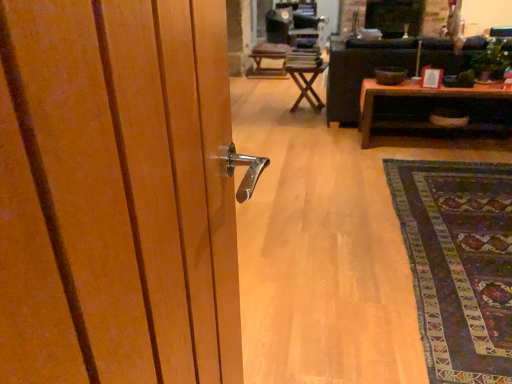
Identify the location of wooden chair at center. (268, 59).

What do you see at coordinates (307, 85) in the screenshot? This screenshot has width=512, height=384. I see `wooden table at center, marked as the second table in a front-to-back arrangement` at bounding box center [307, 85].

Locate an element on the screen. dark purple woven rug at lower right is located at coordinates (459, 264).

Locate an element on the screen. The height and width of the screenshot is (384, 512). brown wooden table at center, which ranks as the 2th table in back-to-front order is located at coordinates click(x=416, y=96).

Is black leather couch at center located outside wooden table at center, arranged as the 2th table when viewed from the right?

Absolutely, black leather couch at center is external to wooden table at center, arranged as the 2th table when viewed from the right.

In the scene shown: How much distance is there between black leather couch at center and wooden table at center, marked as the first table in a left-to-right arrangement?

A distance of 17.87 inches exists between black leather couch at center and wooden table at center, marked as the first table in a left-to-right arrangement.

From the image's perspective, is black leather couch at center below wooden table at center, which is the 1th table from back to front?

No, from the image's perspective, black leather couch at center is not below wooden table at center, which is the 1th table from back to front.

In the scene shown: Considering the sizes of objects black leather couch at center and wooden table at center, arranged as the 2th table when viewed from the right, in the image provided, who is smaller, black leather couch at center or wooden table at center, arranged as the 2th table when viewed from the right,?

wooden table at center, arranged as the 2th table when viewed from the right.

Can you confirm if dark purple woven rug at lower right is positioned to the right of wooden table at center, marked as the first table in a left-to-right arrangement?

Yes.

Is wooden table at center, arranged as the 2th table when viewed from the right, at the back of dark purple woven rug at lower right?

No, dark purple woven rug at lower right is not facing away from wooden table at center, arranged as the 2th table when viewed from the right.

From a real-world perspective, which is physically above, dark purple woven rug at lower right or wooden table at center, arranged as the 2th table when viewed from the right?

wooden table at center, arranged as the 2th table when viewed from the right, from a real-world perspective.

Does dark purple woven rug at lower right have a greater width compared to wooden table at center, marked as the second table in a front-to-back arrangement?

Correct, the width of dark purple woven rug at lower right exceeds that of wooden table at center, marked as the second table in a front-to-back arrangement.

Considering the relative sizes of brown wooden table at center, which is the 2th table from left to right, and dark purple woven rug at lower right in the image provided, is brown wooden table at center, which is the 2th table from left to right, bigger than dark purple woven rug at lower right?

Yes.

How many degrees apart are the facing directions of brown wooden table at center, which ranks as the 2th table in back-to-front order, and dark purple woven rug at lower right?

There is a 180-degree angle between the facing directions of brown wooden table at center, which ranks as the 2th table in back-to-front order, and dark purple woven rug at lower right.

From the image's perspective, does brown wooden table at center, which is the 2th table from left to right, appear higher than dark purple woven rug at lower right?

Yes, from the image's perspective, brown wooden table at center, which is the 2th table from left to right, is over dark purple woven rug at lower right.

Which object is positioned more to the right, brown wooden table at center, marked as the first table in a right-to-left arrangement, or dark purple woven rug at lower right?

brown wooden table at center, marked as the first table in a right-to-left arrangement.

From the image's perspective, is wooden table at center, arranged as the 2th table when viewed from the right, under wooden chair at center?

Correct, wooden table at center, arranged as the 2th table when viewed from the right, appears lower than wooden chair at center in the image.

Between wooden table at center, marked as the second table in a front-to-back arrangement, and wooden chair at center, which one is positioned behind?

wooden chair at center.

Is wooden table at center, marked as the second table in a front-to-back arrangement, far from wooden chair at center?

wooden table at center, marked as the second table in a front-to-back arrangement, is positioned a significant distance from wooden chair at center.

Which is behind, point (301, 83) or point (279, 57)?

The point (279, 57) is behind.

How different are the orientations of black leather couch at center and brown wooden table at center, marked as the first table in a right-to-left arrangement, in degrees?

There is a 180-degree angle between the facing directions of black leather couch at center and brown wooden table at center, marked as the first table in a right-to-left arrangement.

Looking at their sizes, would you say black leather couch at center is wider or thinner than brown wooden table at center, which is the 1th table in front-to-back order?

In the image, black leather couch at center appears to be wider than brown wooden table at center, which is the 1th table in front-to-back order.

From a real-world perspective, does black leather couch at center sit lower than brown wooden table at center, which ranks as the 2th table in back-to-front order?

No, from a real-world perspective, black leather couch at center is not under brown wooden table at center, which ranks as the 2th table in back-to-front order.

Considering their positions, is brown wooden table at center, marked as the first table in a right-to-left arrangement, located in front of or behind wooden chair at center?

brown wooden table at center, marked as the first table in a right-to-left arrangement, is in front of wooden chair at center.

Is brown wooden table at center, which ranks as the 2th table in back-to-front order, wider or thinner than wooden chair at center?

Clearly, brown wooden table at center, which ranks as the 2th table in back-to-front order, has less width compared to wooden chair at center.

From the image's perspective, which object appears higher, brown wooden table at center, which is the 1th table in front-to-back order, or wooden chair at center?

wooden chair at center.

Based on the photo, between brown wooden table at center, which ranks as the 2th table in back-to-front order, and wooden chair at center, which one appears on the left side from the viewer's perspective?

Positioned to the left is wooden chair at center.

Based on their positions, is wooden chair at center located to the left or right of wooden table at center, marked as the first table in a left-to-right arrangement?

From the image, it's evident that wooden chair at center is to the left of wooden table at center, marked as the first table in a left-to-right arrangement.

Can you confirm if wooden chair at center is thinner than wooden table at center, marked as the second table in a front-to-back arrangement?

In fact, wooden chair at center might be wider than wooden table at center, marked as the second table in a front-to-back arrangement.

Which of these two, wooden chair at center or wooden table at center, arranged as the 2th table when viewed from the right, stands taller?

With more height is wooden table at center, arranged as the 2th table when viewed from the right.

Is wooden table at center, marked as the second table in a front-to-back arrangement, at the back of wooden chair at center?

No, wooden chair at center is not facing the opposite direction of wooden table at center, marked as the second table in a front-to-back arrangement.

Identify the location of table located behind the black leather couch at center. The image size is (512, 384). (307, 85).

This screenshot has width=512, height=384. I want to click on table on the left of dark purple woven rug at lower right, so pyautogui.click(x=307, y=85).

Looking at the image, which one is located closer to wooden table at center, marked as the second table in a front-to-back arrangement, black leather couch at center or brown wooden table at center, which ranks as the 2th table in back-to-front order?

black leather couch at center lies closer to wooden table at center, marked as the second table in a front-to-back arrangement, than the other object.

When comparing their distances from wooden chair at center, does black leather couch at center or dark purple woven rug at lower right seem closer?

black leather couch at center.

Based on the photo, looking at the image, which one is located closer to wooden chair at center, brown wooden table at center, which is the 1th table in front-to-back order, or wooden table at center, arranged as the 2th table when viewed from the right?

wooden table at center, arranged as the 2th table when viewed from the right.

Based on their spatial positions, is black leather couch at center or dark purple woven rug at lower right closer to wooden table at center, which is the 1th table from back to front?

Among the two, black leather couch at center is located nearer to wooden table at center, which is the 1th table from back to front.

Which object lies further to the anchor point wooden table at center, marked as the second table in a front-to-back arrangement, brown wooden table at center, which is the 2th table from left to right, or black leather couch at center?

brown wooden table at center, which is the 2th table from left to right, lies further to wooden table at center, marked as the second table in a front-to-back arrangement, than the other object.

From the image, which object appears to be farther from black leather couch at center, wooden chair at center or dark purple woven rug at lower right?

wooden chair at center.

When comparing their distances from black leather couch at center, does brown wooden table at center, marked as the first table in a right-to-left arrangement, or wooden table at center, which is the 1th table from back to front, seem closer?

brown wooden table at center, marked as the first table in a right-to-left arrangement, is positioned closer to the anchor black leather couch at center.

When comparing their distances from brown wooden table at center, which is the 1th table in front-to-back order, does black leather couch at center or wooden table at center, which is the 1th table from back to front, seem further?

Based on the image, wooden table at center, which is the 1th table from back to front, appears to be further to brown wooden table at center, which is the 1th table in front-to-back order.

Where is `studio couch between dark purple woven rug at lower right and wooden chair at center along the z-axis`? The width and height of the screenshot is (512, 384). studio couch between dark purple woven rug at lower right and wooden chair at center along the z-axis is located at coordinates (361, 72).

You are a GUI agent. You are given a task and a screenshot of the screen. Output one action in this format:
    pyautogui.click(x=<x>, y=<y>)
    Task: Click on the studio couch located between dark purple woven rug at lower right and wooden table at center, which is the 1th table from back to front, in the depth direction
    Image resolution: width=512 pixels, height=384 pixels.
    Given the screenshot: What is the action you would take?
    pyautogui.click(x=361, y=72)

Locate an element on the screen. table located between dark purple woven rug at lower right and black leather couch at center in the depth direction is located at coordinates (416, 96).

You are a GUI agent. You are given a task and a screenshot of the screen. Output one action in this format:
    pyautogui.click(x=<x>, y=<y>)
    Task: Click on the table between black leather couch at center and wooden chair at center from front to back
    
    Given the screenshot: What is the action you would take?
    pyautogui.click(x=307, y=85)